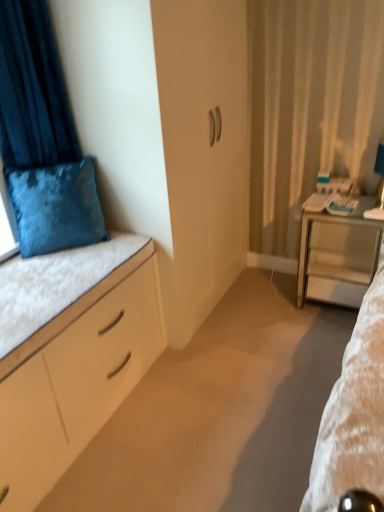
Question: Which is correct: metallic silver desk at right is inside matte white table lamp at right, or outside of it?

Choices:
 (A) inside
 (B) outside

Answer: (B)

Question: Is metallic silver desk at right in front of or behind matte white table lamp at right in the image?

Choices:
 (A) behind
 (B) front

Answer: (B)

Question: Which of these objects is positioned farthest from the metallic silver desk at right?

Choices:
 (A) velvet blue cushion at upper left
 (B) white matte cushion at left
 (C) velvet blue pillow at upper left
 (D) matte white table lamp at right
 (E) white glossy bed at left

Answer: (A)

Question: Based on their relative distances, which object is nearer to the matte white table lamp at right?

Choices:
 (A) white glossy bed at left
 (B) velvet blue pillow at upper left
 (C) velvet blue cushion at upper left
 (D) metallic silver desk at right
 (E) white matte cushion at left

Answer: (D)